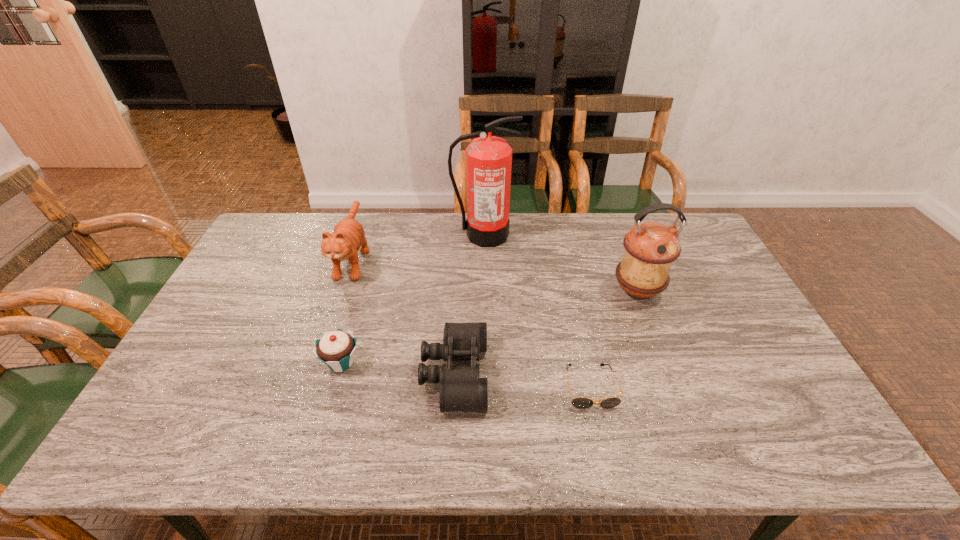
This screenshot has width=960, height=540. I want to click on blank space located on the face of the cat, so click(331, 325).

What are the coordinates of `vacant space located 0.350m on the right of the cupcake` in the screenshot? It's located at (494, 363).

The width and height of the screenshot is (960, 540). In order to click on vacant area located 0.050m at the eyepieces of the binoculars in this screenshot , I will do `click(506, 374)`.

Find the location of a particular element. This screenshot has width=960, height=540. fire extinguisher situated at the far edge is located at coordinates (488, 158).

Where is `cat that is at the far edge`? The width and height of the screenshot is (960, 540). cat that is at the far edge is located at coordinates (348, 236).

In the image, there is a desktop. Where is `vacant space at the far edge`? The height and width of the screenshot is (540, 960). vacant space at the far edge is located at coordinates (540, 233).

Identify the location of free space at the near edge of the desktop. This screenshot has height=540, width=960. (215, 437).

I want to click on vacant space at the left edge of the desktop, so pyautogui.click(x=233, y=315).

I want to click on vacant space at the right edge of the desktop, so click(747, 372).

Where is `vacant space at the far left corner of the desktop`? This screenshot has width=960, height=540. vacant space at the far left corner of the desktop is located at coordinates (252, 253).